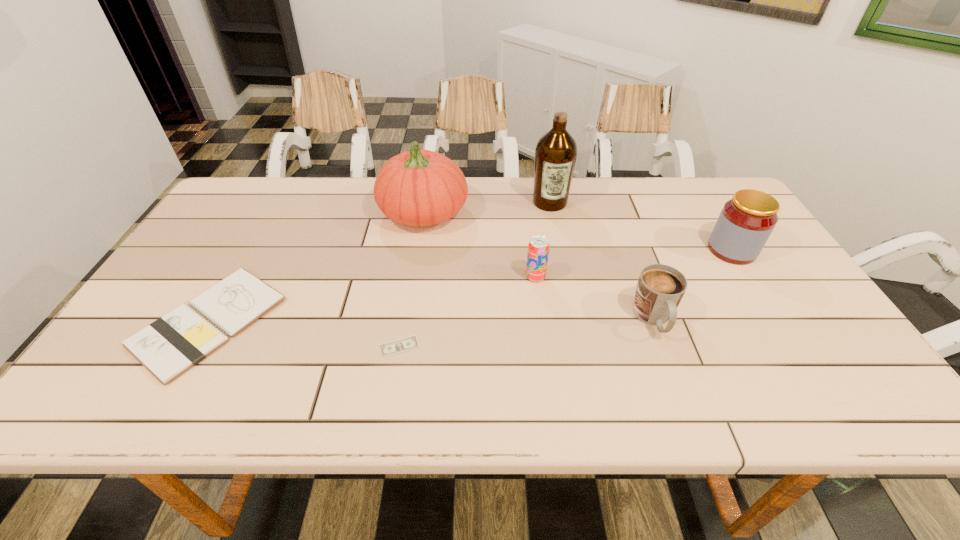
The image size is (960, 540). Identify the location of free space that satisfies the following two spatial constraints: 1. on the front side of the pumpkin; 2. on the right side of the rightmost object. (418, 250).

Identify the location of vacant region that satisfies the following two spatial constraints: 1. on the back side of the fifth shortest object; 2. on the left side of the leftmost object. Image resolution: width=960 pixels, height=540 pixels. (251, 250).